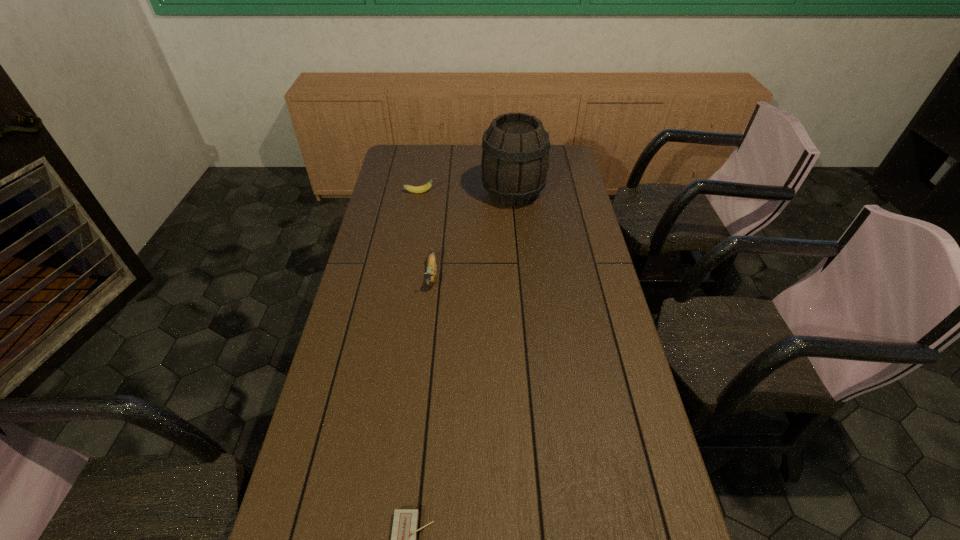
Where is `wine bucket`? This screenshot has width=960, height=540. wine bucket is located at coordinates (515, 148).

I want to click on the tallest object, so click(x=515, y=148).

Find the location of a particular element. The image size is (960, 540). the second tallest object is located at coordinates (431, 274).

Where is `the nearer banana`? The height and width of the screenshot is (540, 960). the nearer banana is located at coordinates (431, 274).

The width and height of the screenshot is (960, 540). What are the coordinates of `the third tallest object` in the screenshot? It's located at (419, 189).

Image resolution: width=960 pixels, height=540 pixels. Identify the location of the shorter banana. (419, 189).

This screenshot has width=960, height=540. Find the location of `vacant region located 0.170m on the left of the wine bucket`. vacant region located 0.170m on the left of the wine bucket is located at coordinates (441, 193).

Identify the location of vacant region located at the stem of the nearer banana. This screenshot has width=960, height=540. (424, 346).

Locate an element on the screen. free location located 0.160m at the stem of the farther banana is located at coordinates (x=474, y=192).

This screenshot has width=960, height=540. Identify the location of object at the left edge. (419, 189).